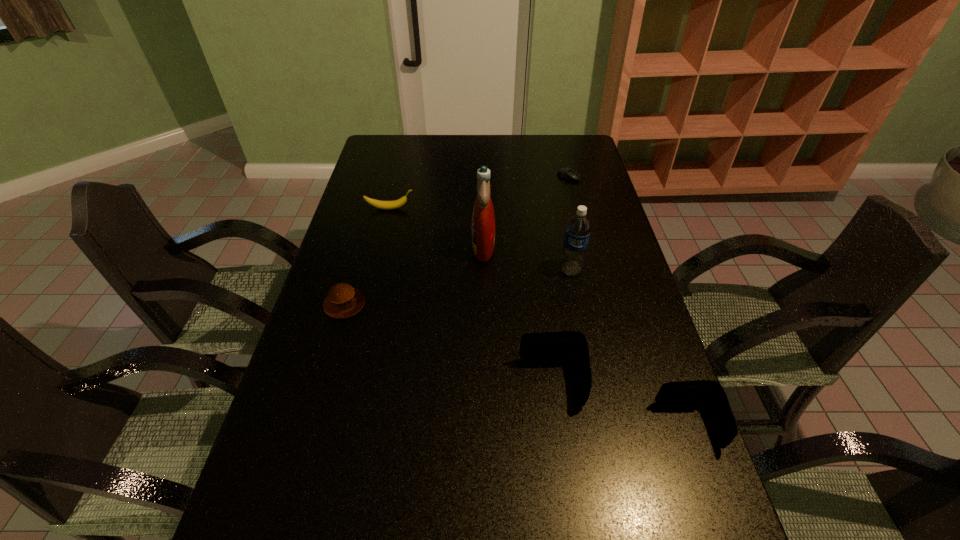
At what (x,y) coordinates should I click in order to perform the action: click on the left wallet. Please return your answer as a coordinate pair (x, y). The height and width of the screenshot is (540, 960). Looking at the image, I should click on [562, 345].

Identify the location of the taller wallet. This screenshot has height=540, width=960. (562, 345).

This screenshot has width=960, height=540. Find the location of `the shorter wallet`. the shorter wallet is located at coordinates (711, 394).

Identify the location of the rightmost object. This screenshot has height=540, width=960. (711, 394).

Identify the location of the second shortest object. (343, 301).

Locate an element on the screen. The height and width of the screenshot is (540, 960). the fifth farthest object is located at coordinates (343, 301).

Locate an element on the screen. computer mouse is located at coordinates (568, 173).

Where is `the farthest object`? Image resolution: width=960 pixels, height=540 pixels. the farthest object is located at coordinates (568, 173).

The height and width of the screenshot is (540, 960). What are the coordinates of `water bottle` in the screenshot? It's located at (578, 228).

Where is `the tallest object`? the tallest object is located at coordinates pyautogui.click(x=483, y=219).